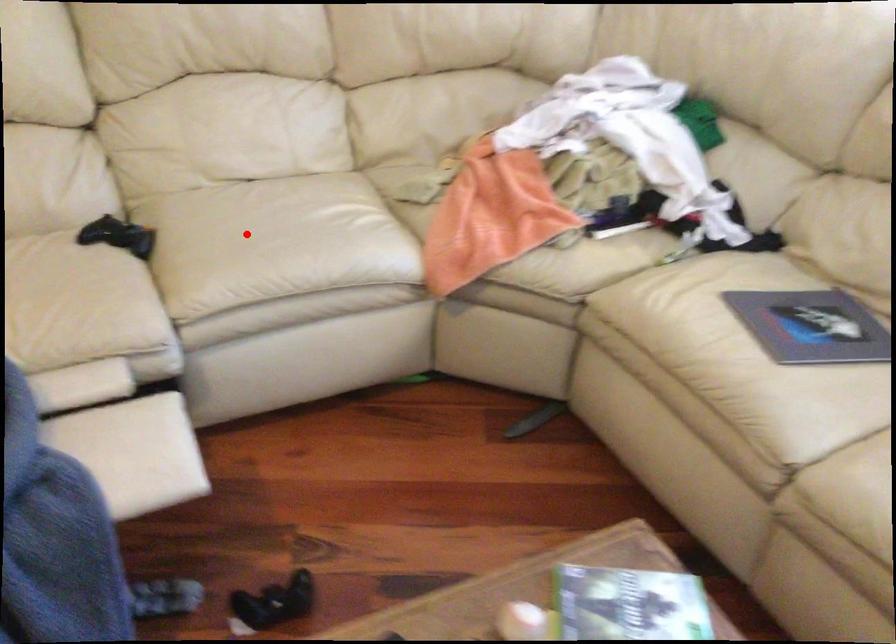
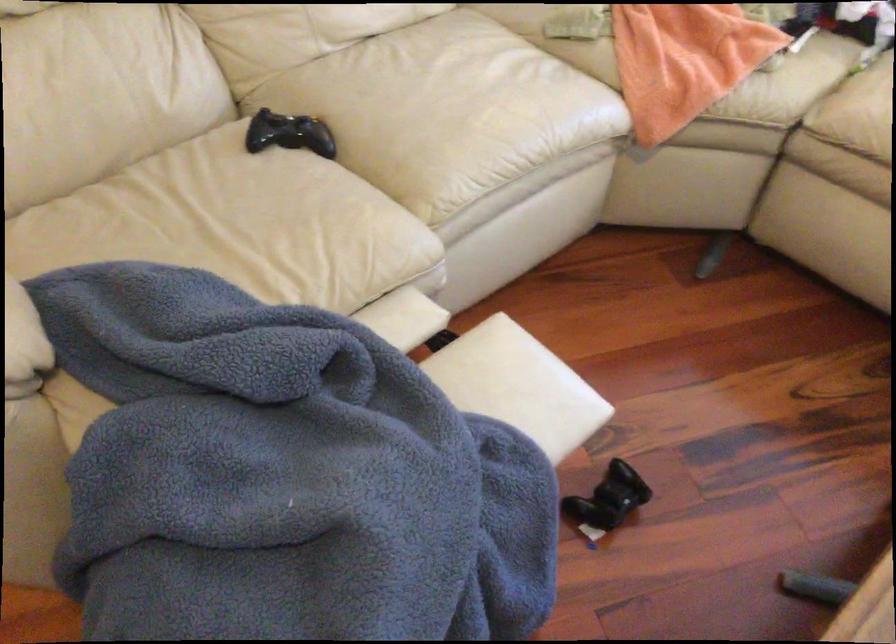
The point at the highlighted location is marked in the first image. Where is the corresponding point in the second image?

(446, 109)